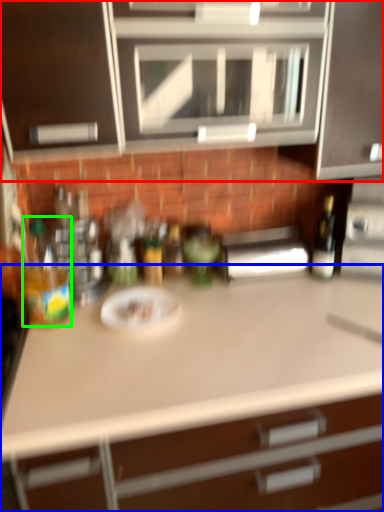
Question: Which is nearer to the cabinetry (highlighted by a red box)? countertop (highlighted by a blue box) or bottle (highlighted by a green box).

Choices:
 (A) countertop
 (B) bottle

Answer: (B)